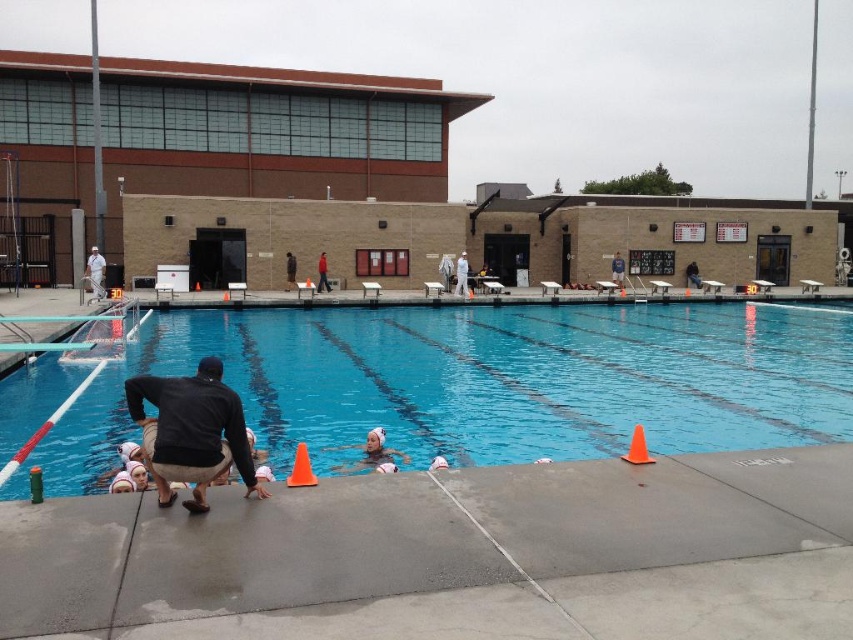
In the scene shown: Does white matte uniform at upper left have a greater width compared to orange plastic cone at lower right?

Correct, the width of white matte uniform at upper left exceeds that of orange plastic cone at lower right.

Who is positioned more to the left, white matte uniform at upper left or orange plastic cone at lower right?

Positioned to the left is white matte uniform at upper left.

Is point (102, 291) positioned behind point (622, 456)?

Yes, point (102, 291) is farther from viewer.

This screenshot has width=853, height=640. I want to click on white matte uniform at upper left, so click(96, 273).

Does blue smooth water at lower center have a larger size compared to white matte swim cap at center?

Indeed, blue smooth water at lower center has a larger size compared to white matte swim cap at center.

The image size is (853, 640). In order to click on blue smooth water at lower center in this screenshot , I will do `click(485, 381)`.

Who is more distant from viewer, (463, 340) or (404, 460)?

Positioned behind is point (463, 340).

Identify the location of blue smooth water at lower center. This screenshot has height=640, width=853. (485, 381).

Where is `black cotton shirt at lower left`? black cotton shirt at lower left is located at coordinates (192, 432).

At what (x,y) coordinates should I click in order to perform the action: click on black cotton shirt at lower left. Please return your answer as a coordinate pair (x, y). The image size is (853, 640). Looking at the image, I should click on (192, 432).